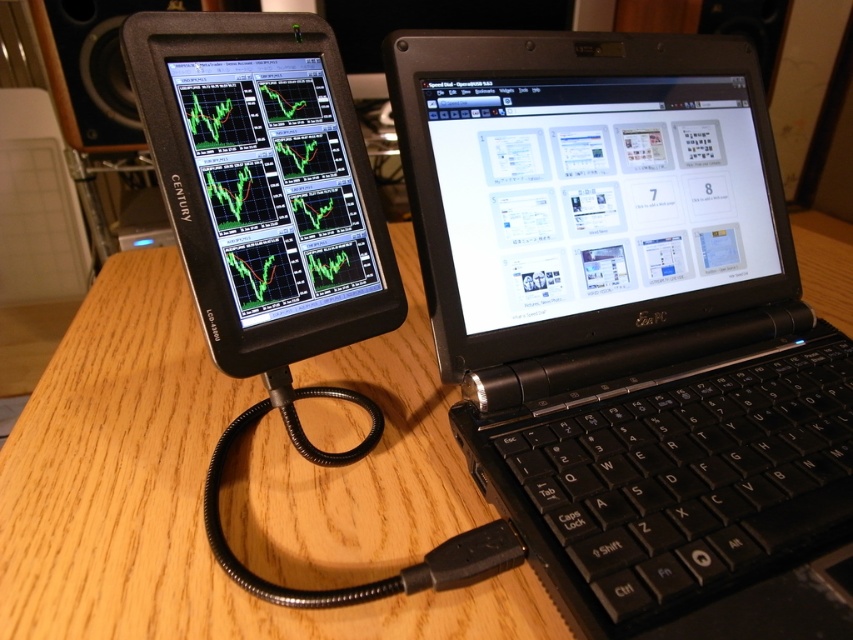
Looking at this image, you are organizing a desk and need to place a new keyboard between the black plastic laptop at center and the wooden table at center. Since the laptop is in front of the table, where should you position the keyboard to ensure it is between them?

The black plastic laptop at center is in front of the wooden table at center, so you should place the keyboard on the desk between them, positioning it closer to the laptop to maintain the spatial relationship.

You are setting up a new desk and want to ensure your black plastic keyboard at center and matte black screen at left are positioned for comfortable reach. The recommended ergonomic distance between a keyboard and monitor is at least 12 inches. Based on the image, is the current setup meeting this requirement?

The distance between the black plastic keyboard at center and matte black screen at left is 8.19 inches, which is less than the recommended 12 inches. Therefore, the current setup does not meet the ergonomic requirement.